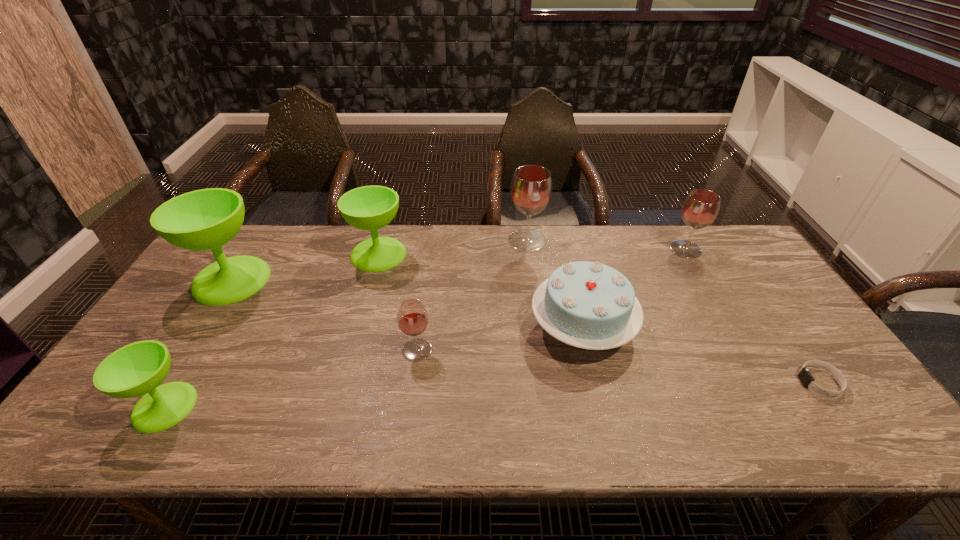
Locate an element on the screen. the second red wineglass from left to right is located at coordinates pyautogui.click(x=531, y=188).

Locate an element on the screen. Image resolution: width=960 pixels, height=540 pixels. the biggest red wineglass is located at coordinates (531, 188).

Where is `the biggest green wineglass`? The width and height of the screenshot is (960, 540). the biggest green wineglass is located at coordinates (206, 219).

Identify the location of the rightmost red wineglass. (701, 207).

Locate an element on the screen. The width and height of the screenshot is (960, 540). the second smallest red wineglass is located at coordinates (701, 207).

At what (x,y) coordinates should I click in order to perform the action: click on the second smallest green wineglass. Please return your answer as a coordinate pair (x, y). Looking at the image, I should click on (369, 208).

What are the coordinates of `the fourth wineglass from right to left` in the screenshot? It's located at (369, 208).

Locate an element on the screen. The width and height of the screenshot is (960, 540). blue birthday cake is located at coordinates (588, 305).

This screenshot has width=960, height=540. Find the location of `the leftmost red wineglass`. the leftmost red wineglass is located at coordinates (412, 317).

The width and height of the screenshot is (960, 540). I want to click on the fifth farthest wineglass, so click(x=412, y=317).